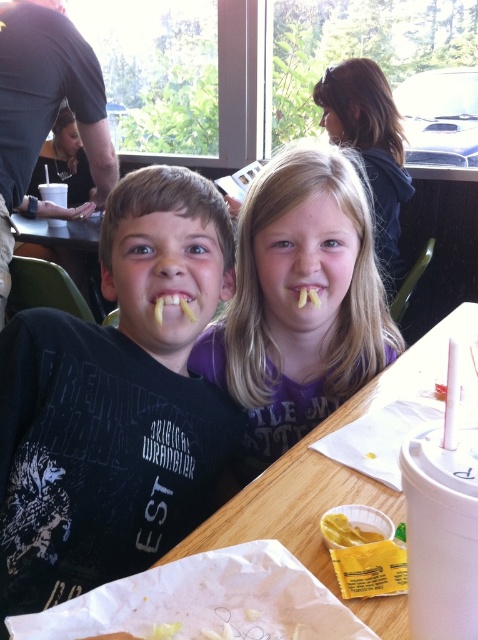
Question: Among these points, which one is farthest from the camera?

Choices:
 (A) (160, 477)
 (B) (315, 304)
 (C) (311, 422)
 (D) (295, 291)

Answer: (C)

Question: Can you confirm if matte black shirt at center is positioned to the right of yellow paper packet at lower center?

Choices:
 (A) no
 (B) yes

Answer: (A)

Question: Which is nearer to the matte black shirt at center?

Choices:
 (A) yellow matte french fries at mouth center
 (B) blonde hair at upper center
 (C) yellow matte french fries at center

Answer: (C)

Question: Does matte black shirt at center have a smaller size compared to blonde hair at upper center?

Choices:
 (A) no
 (B) yes

Answer: (B)

Question: Among these points, which one is nearest to the camera?

Choices:
 (A) (341, 518)
 (B) (373, 196)
 (C) (347, 168)

Answer: (A)

Question: Can you confirm if blonde hair at upper center is wider than yellow paper packet at lower center?

Choices:
 (A) yes
 (B) no

Answer: (A)